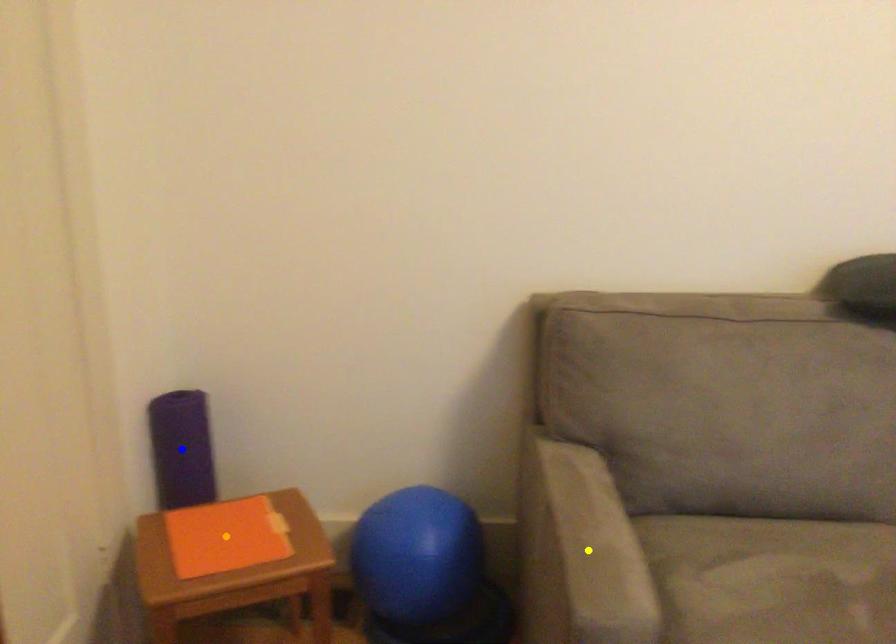
Order these from nearest to farthest:
1. blue point
2. orange point
3. yellow point

blue point → orange point → yellow point